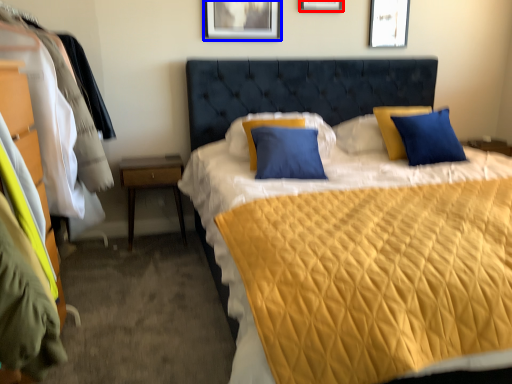
Question: Which object is closer to the camera taking this photo, picture frame (highlighted by a red box) or picture frame (highlighted by a blue box)?

Choices:
 (A) picture frame
 (B) picture frame

Answer: (B)